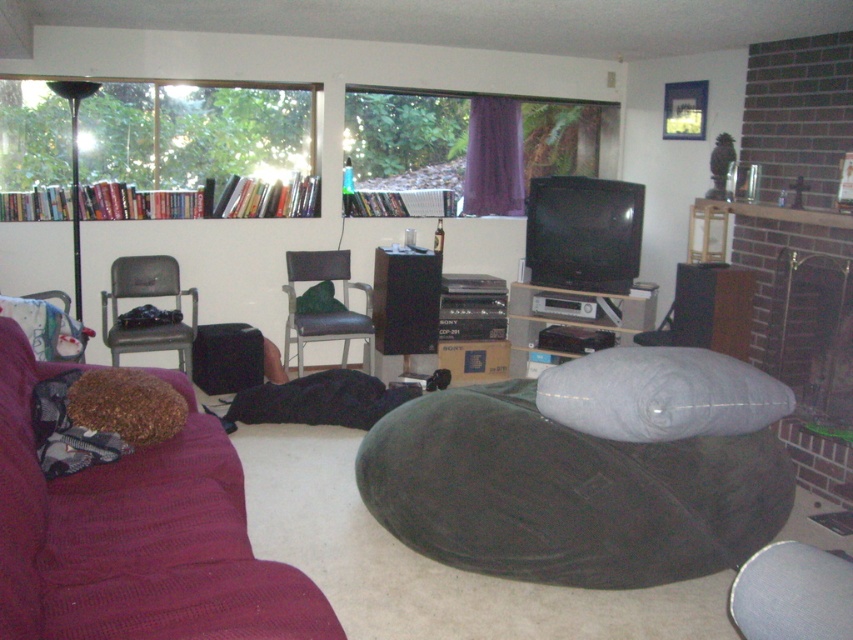
You are sitting on the metallic gray chair at left and want to pick up the gray fabric pillow at center. Which direction should you move to reach it?

Since the gray fabric pillow at center is closer to the viewer than the metallic gray chair at left, you should move forward to reach it.

You are standing in the living room and want to take a photo of both the point at coordinates (x=631, y=401) and the point at coordinates (x=160, y=260). Which point should you focus on first to ensure both are in focus?

You should focus on point (x=160, y=260) first because it is further away from the camera compared to point (x=631, y=401). This way, the depth of field will cover both points effectively.